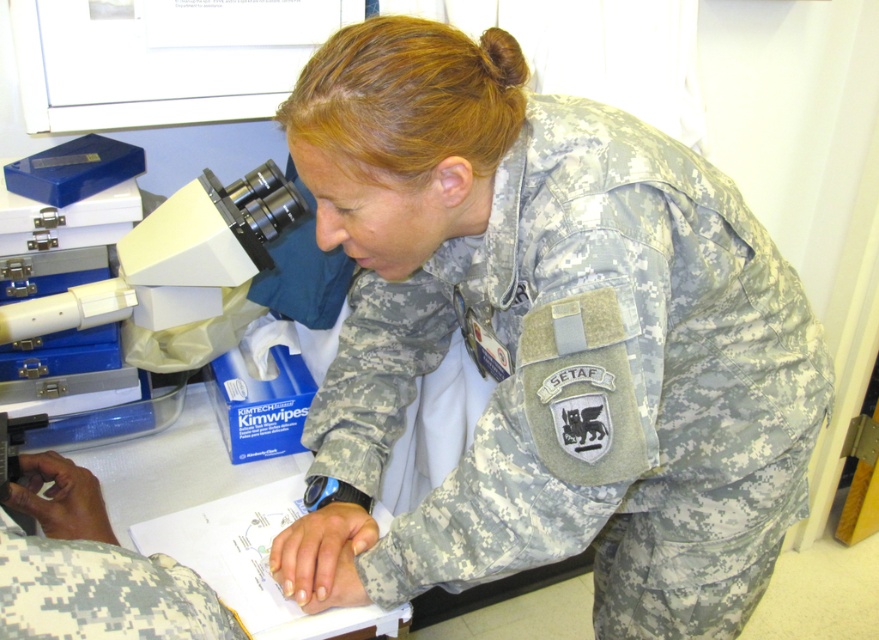
Does camouflage fabric uniform at center have a larger size compared to white plastic microscope at left?

Yes, camouflage fabric uniform at center is bigger than white plastic microscope at left.

Which is above, camouflage fabric uniform at center or white plastic microscope at left?

white plastic microscope at left

Does point (766, 385) lie in front of point (291, 195)?

Yes, point (766, 385) is closer to viewer.

Where is `camouflage fabric uniform at center`? Image resolution: width=879 pixels, height=640 pixels. camouflage fabric uniform at center is located at coordinates (x=593, y=381).